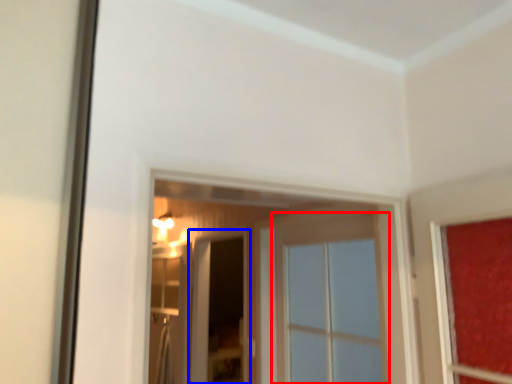
Question: Among these objects, which one is farthest to the camera, window (highlighted by a red box) or screen door (highlighted by a blue box)?

Choices:
 (A) window
 (B) screen door

Answer: (B)